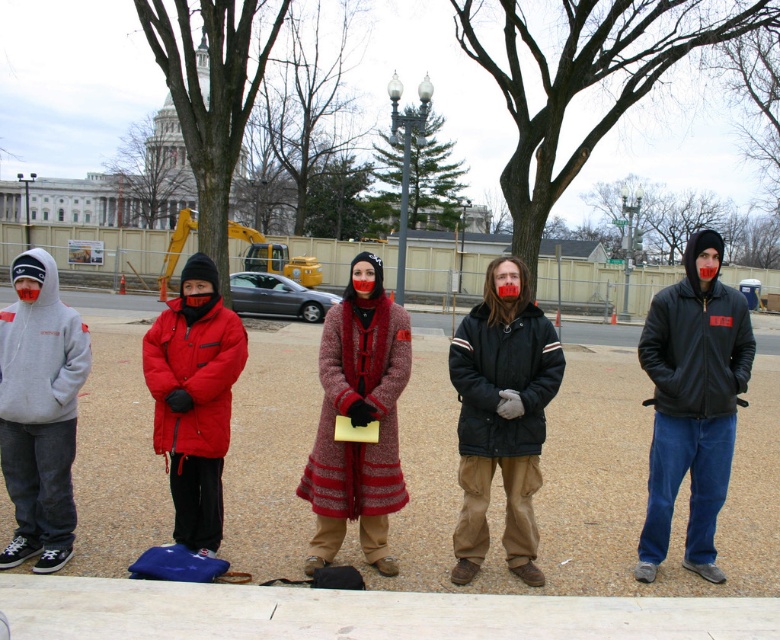
Looking at this image, is knitted wool coat at center below matte red puffer jacket at center?

Yes.

Who is higher up, knitted wool coat at center or matte red puffer jacket at center?

matte red puffer jacket at center is above.

Describe the element at coordinates (357, 419) in the screenshot. I see `knitted wool coat at center` at that location.

At what (x,y) coordinates should I click in order to perform the action: click on knitted wool coat at center. Please return your answer as a coordinate pair (x, y). The width and height of the screenshot is (780, 640). Looking at the image, I should click on (357, 419).

Can you confirm if black leather jacket at center is positioned to the right of gray hoodie at left?

Indeed, black leather jacket at center is positioned on the right side of gray hoodie at left.

Measure the distance between black leather jacket at center and gray hoodie at left.

12.21 feet

Is point (661, 339) in front of point (34, 337)?

No.

You are a GUI agent. You are given a task and a screenshot of the screen. Output one action in this format:
    pyautogui.click(x=<x>, y=<y>)
    Task: Click on the black leather jacket at center
    Image resolution: width=780 pixels, height=640 pixels.
    Given the screenshot: What is the action you would take?
    pyautogui.click(x=692, y=403)

Is point (519, 316) in front of point (30, 298)?

No.

Is dark brown leather jacket at center smaller than gray hoodie at left?

No.

At what (x,y) coordinates should I click in order to perform the action: click on dark brown leather jacket at center. Please return your answer as a coordinate pair (x, y). Looking at the image, I should click on (502, 416).